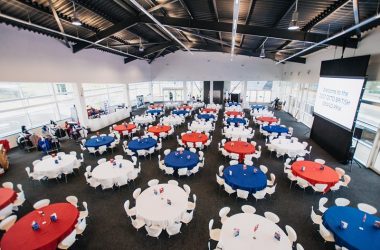
Identify the location of table centerpieces. (363, 216), (255, 225), (161, 191), (40, 213), (244, 167).